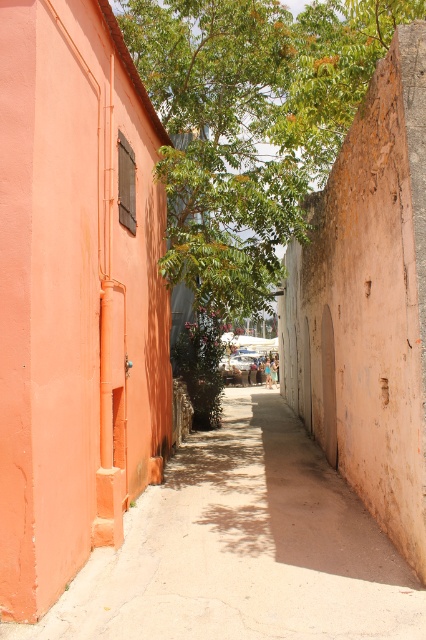
You are a delivery person carrying a large package and need to walk through the narrow alleyway. The smooth concrete path at center and the green leafy tree at upper center are in your way. Which one will you have to navigate around due to its size?

The smooth concrete path at center has a larger size compared to the green leafy tree at upper center. Therefore, you will need to navigate around the green leafy tree at upper center since it is smaller and might be in the way of the path.

You are standing at the entrance of the alleyway and want to walk straight ahead. Where should you step to stay on the smooth concrete path at center?

The smooth concrete path at center is located at the coordinates point (241, 547), so you should step there to stay on it.

You are a delivery person with a cart that is 2 meters wide. You need to navigate through the narrow alleyway shown in the image. Is there enough space between the orange wall on the left and the brown wall on the right to move your cart through the smooth concrete path at center?

The distance between the orange wall on the left and the brown wall on the right is 4.50 meters, which is wider than the cart width of 2 meters. Therefore, there is sufficient space to move the cart through the smooth concrete path at center.